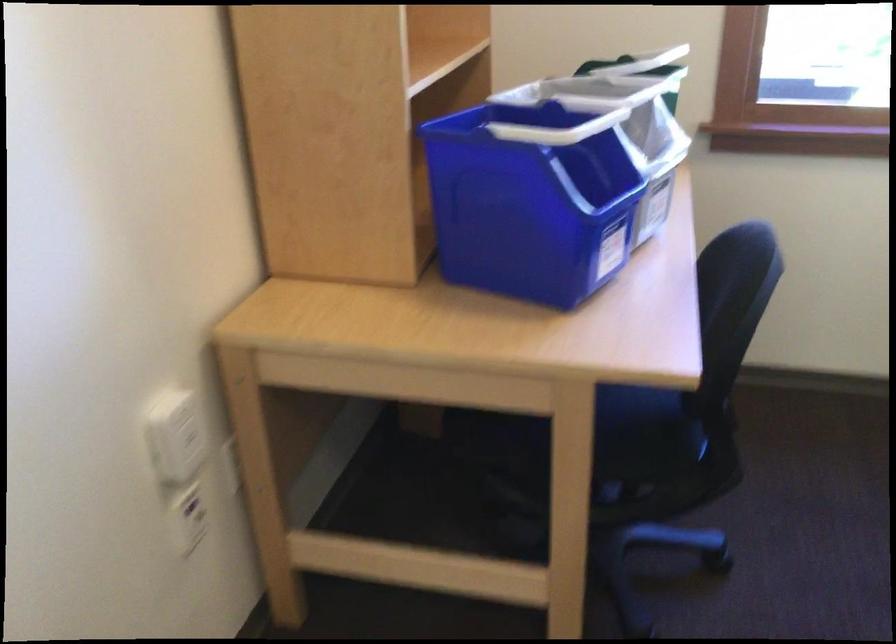
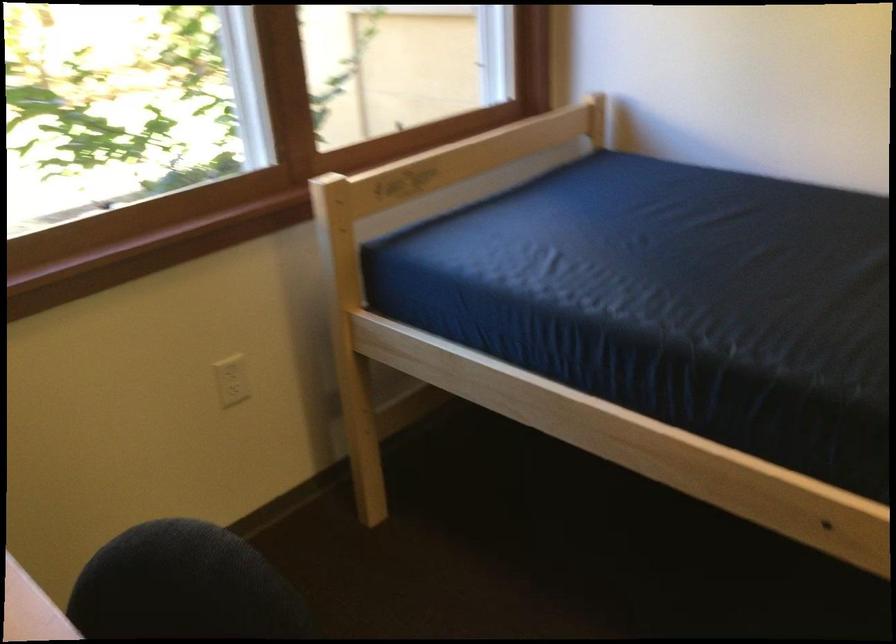
Question: The first image is from the beginning of the video and the second image is from the end. How did the camera likely rotate when shooting the video?

Choices:
 (A) Left
 (B) Right
 (C) Up
 (D) Down

Answer: (B)